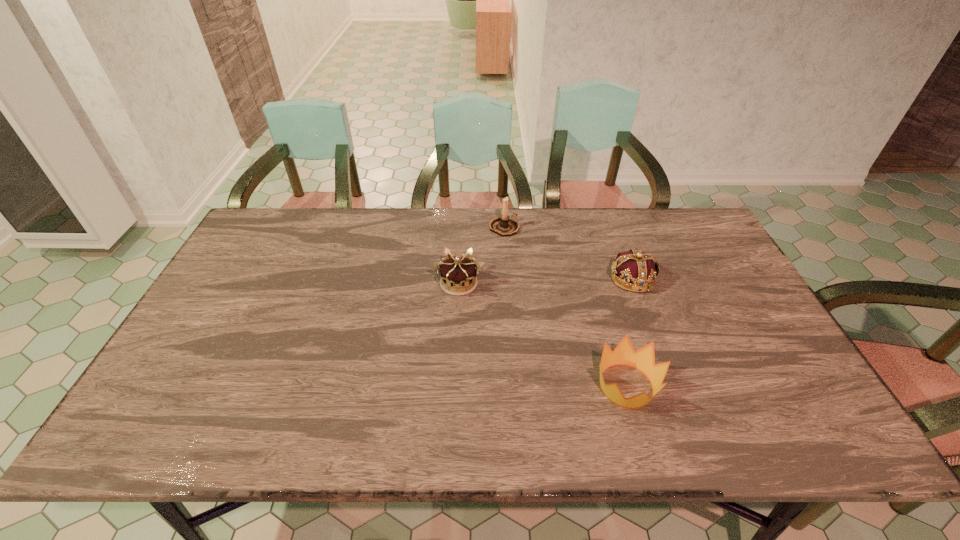
Where is `the third closest object relative to the nearest object`? the third closest object relative to the nearest object is located at coordinates (504, 226).

Identify the location of the third closest crown to the tallest object. (643, 359).

Locate which crown is the closest to the nearest object. Please provide its 2D coordinates. Your answer should be formatted as a tuple, i.e. [(x, y)], where the tuple contains the x and y coordinates of a point satisfying the conditions above.

[(637, 268)]

Where is `free spot that satisfies the following two spatial constraints: 1. on the front side of the leftmost crown; 2. on the left side of the nearest crown`? free spot that satisfies the following two spatial constraints: 1. on the front side of the leftmost crown; 2. on the left side of the nearest crown is located at coordinates pyautogui.click(x=453, y=386).

At what (x,y) coordinates should I click in order to perform the action: click on vacant region that satisfies the following two spatial constraints: 1. on the back side of the leftmost crown; 2. on the right side of the farthest object. Please return your answer as a coordinate pair (x, y). This screenshot has height=540, width=960. Looking at the image, I should click on (462, 228).

I want to click on vacant space that satisfies the following two spatial constraints: 1. on the front side of the nearest object; 2. on the right side of the candle holder, so coord(515,386).